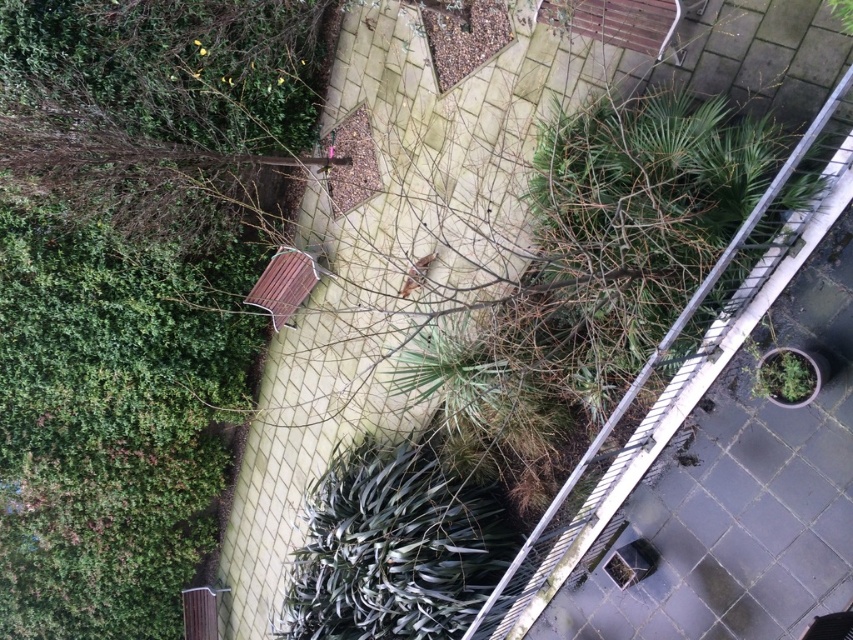
Question: Does wooden bench at center have a lesser width compared to green matte pot at right?

Choices:
 (A) no
 (B) yes

Answer: (A)

Question: Considering the relative positions of wooden bench at center and green matte pot at right in the image provided, where is wooden bench at center located with respect to green matte pot at right?

Choices:
 (A) below
 (B) above

Answer: (B)

Question: Which point is closer to the camera?

Choices:
 (A) coord(279,285)
 (B) coord(793,353)

Answer: (B)

Question: Among these objects, which one is farthest from the camera?

Choices:
 (A) wooden bench at center
 (B) green matte pot at right

Answer: (A)

Question: Does wooden bench at center come in front of green matte pot at right?

Choices:
 (A) yes
 (B) no

Answer: (B)